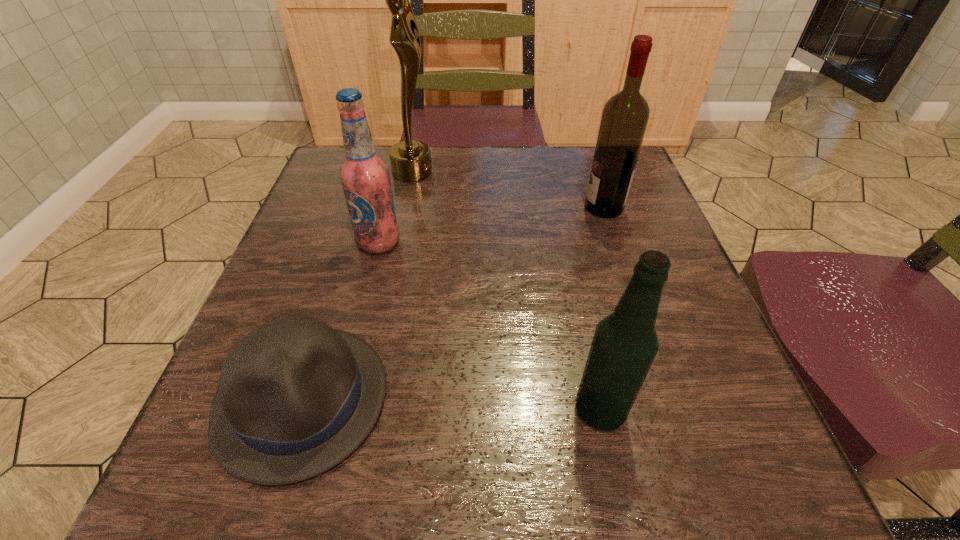
You are a GUI agent. You are given a task and a screenshot of the screen. Output one action in this format:
    pyautogui.click(x=<x>, y=<y>)
    Task: Click on the vacant position located on the front and back of the fourth nearest object
    Image resolution: width=960 pixels, height=540 pixels.
    Given the screenshot: What is the action you would take?
    pyautogui.click(x=562, y=207)

Locate an element on the screen. vacant region located on the front and back of the fourth nearest object is located at coordinates (459, 207).

Identify the location of free space located on the right of the leftmost alcohol. (592, 243).

I want to click on free location located 0.340m on the left of the second object from right to left, so pos(340,410).

Where is `award that is positioned at the far edge`? Image resolution: width=960 pixels, height=540 pixels. award that is positioned at the far edge is located at coordinates (410, 160).

Find the location of a particular element. Image resolution: width=960 pixels, height=540 pixels. alcohol that is at the far edge is located at coordinates (625, 116).

Identify the location of object located in the near edge section of the desktop. This screenshot has width=960, height=540. (295, 397).

Find the location of a particular element. This screenshot has height=540, width=960. alcohol located at the left edge is located at coordinates (365, 177).

You are a GUI agent. You are given a task and a screenshot of the screen. Output one action in this format:
    pyautogui.click(x=<x>, y=<y>)
    Task: Click on the bowler hat that is at the left edge
    The width and height of the screenshot is (960, 540).
    Given the screenshot: What is the action you would take?
    click(x=295, y=397)

Find the location of a particular element. This screenshot has width=960, height=540. object located at the right edge is located at coordinates (625, 116).